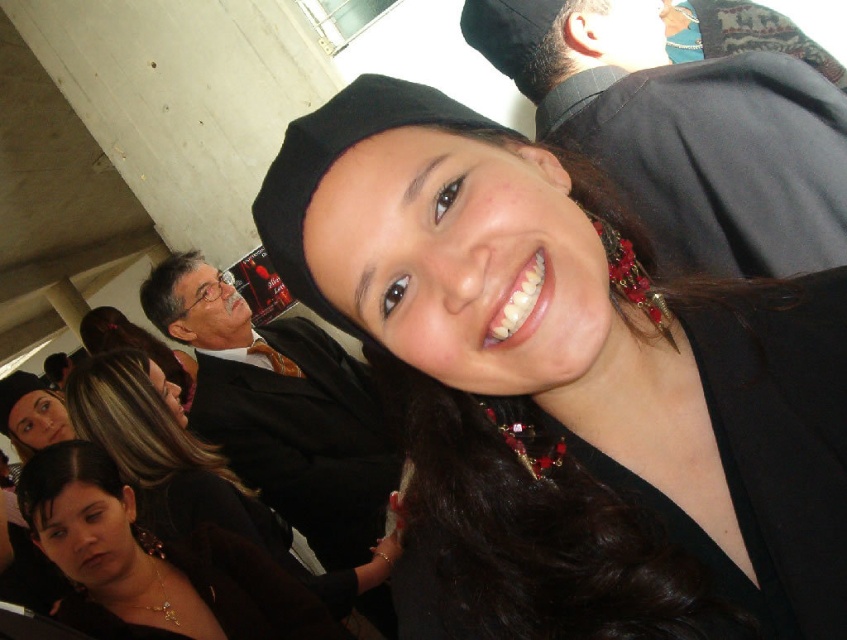
Does matte black hat at center have a smaller size compared to matte black hair at lower left?

No, matte black hat at center is not smaller than matte black hair at lower left.

Is point (789, 552) closer to viewer compared to point (183, 620)?

Yes, it is.

The height and width of the screenshot is (640, 847). Describe the element at coordinates (567, 387) in the screenshot. I see `matte black hat at center` at that location.

The width and height of the screenshot is (847, 640). Find the location of `matte black hat at center`. matte black hat at center is located at coordinates (567, 387).

Who is more forward, (367, 452) or (184, 636)?

Point (184, 636) is in front.

Is black suit at center to the left of matte black hair at lower left from the viewer's perspective?

No, black suit at center is not to the left of matte black hair at lower left.

This screenshot has height=640, width=847. I want to click on black suit at center, so click(281, 408).

The image size is (847, 640). In order to click on black suit at center in this screenshot , I will do `click(281, 408)`.

Based on the photo, which is above, matte black hat at center or black suit at center?

Positioned higher is matte black hat at center.

Between matte black hat at center and black suit at center, which one is positioned lower?

black suit at center

Does point (436, 333) lie in front of point (263, 340)?

Yes, point (436, 333) is in front of point (263, 340).

This screenshot has height=640, width=847. I want to click on matte black hat at center, so click(567, 387).